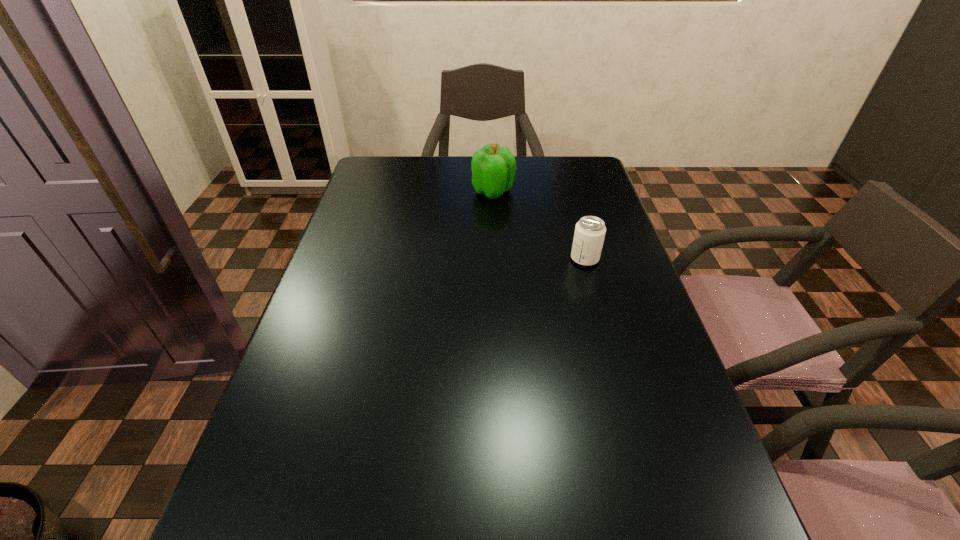
You are a GUI agent. You are given a task and a screenshot of the screen. Output one action in this format:
    pyautogui.click(x=<x>, y=<y>)
    Task: Click on the taller object
    
    Given the screenshot: What is the action you would take?
    pyautogui.click(x=493, y=167)

This screenshot has height=540, width=960. What are the coordinates of `the left object` in the screenshot? It's located at (493, 167).

Where is `soda can`? The image size is (960, 540). soda can is located at coordinates (590, 231).

Where is `the right object`? the right object is located at coordinates (590, 231).

Locate an element on the screen. The image size is (960, 540). blank area located 0.250m on the right of the farther object is located at coordinates tap(593, 191).

Image resolution: width=960 pixels, height=540 pixels. What are the coordinates of `vacant space located 0.220m on the left of the nearer object` in the screenshot? It's located at (487, 259).

This screenshot has width=960, height=540. Find the location of `object that is at the far edge`. object that is at the far edge is located at coordinates pyautogui.click(x=493, y=167).

I want to click on object present at the right edge, so click(x=590, y=231).

Where is `free spot at the far edge of the desktop`? The width and height of the screenshot is (960, 540). free spot at the far edge of the desktop is located at coordinates (442, 156).

Find the location of `free space at the left edge`. free space at the left edge is located at coordinates (399, 192).